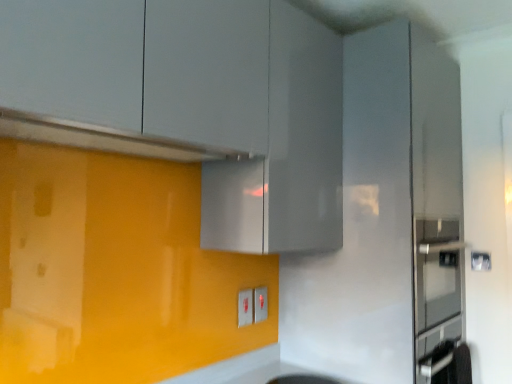
Question: Is point (225, 155) positioned closer to the camera than point (198, 87)?

Choices:
 (A) farther
 (B) closer

Answer: (A)

Question: Is satin silver exhaust hood at upper center taller or shorter than matte gray cabinet at upper center?

Choices:
 (A) tall
 (B) short

Answer: (B)

Question: Which object is the closest to the matte white electric outlet at lower center, arranged as the second electric outlet when viewed from the front?

Choices:
 (A) white plastic electric outlet at center, the 2th electric outlet positioned from the right
 (B) satin silver exhaust hood at upper center
 (C) matte gray cabinet at upper center

Answer: (A)

Question: Based on their relative distances, which object is nearer to the satin silver exhaust hood at upper center?

Choices:
 (A) matte white electric outlet at lower center, arranged as the second electric outlet when viewed from the front
 (B) white plastic electric outlet at center, the 1th electric outlet in the front-to-back sequence
 (C) matte gray cabinet at upper center

Answer: (C)